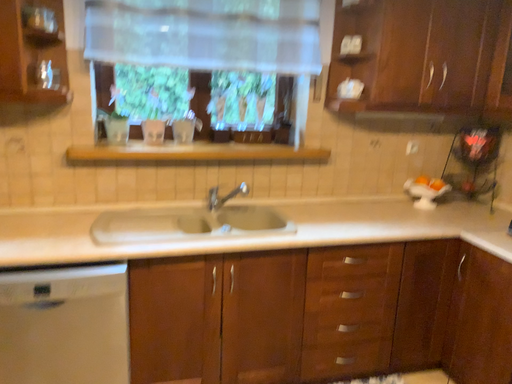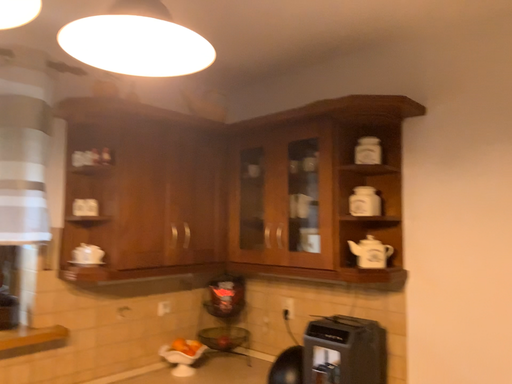
Question: Which way did the camera rotate in the video?

Choices:
 (A) rotated downward
 (B) rotated upward

Answer: (B)